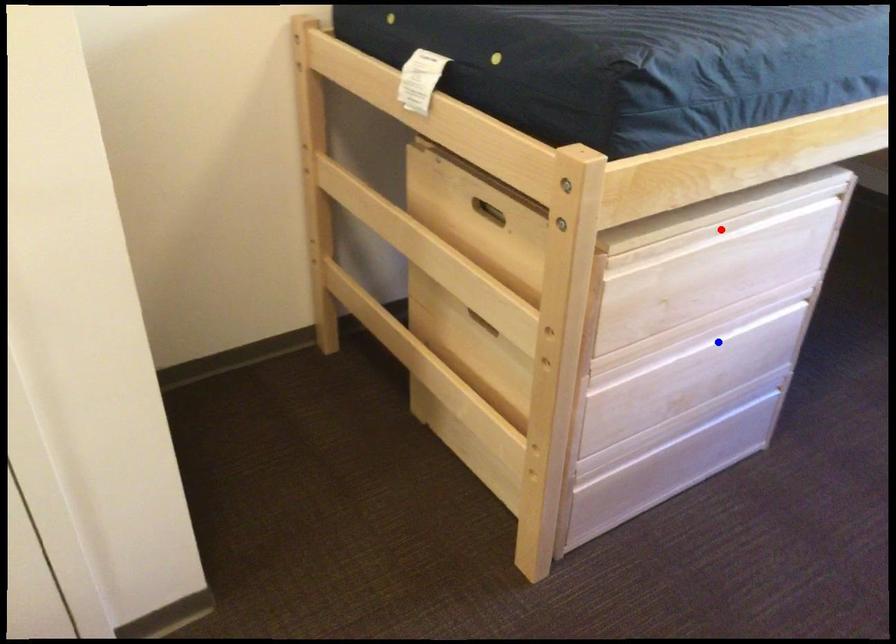
Question: Which of the two points in the image is closer to the camera?

Choices:
 (A) Blue point is closer.
 (B) Red point is closer.

Answer: (B)